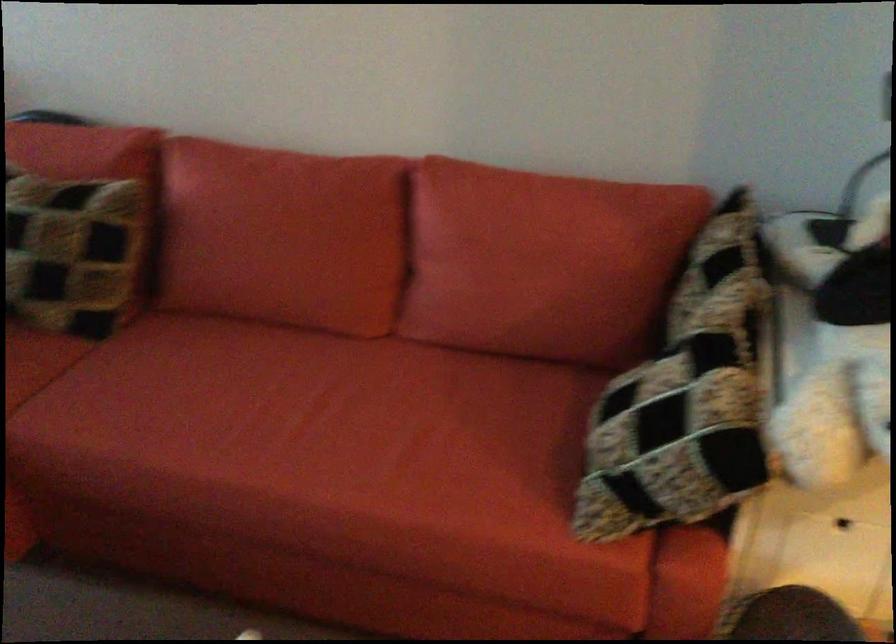
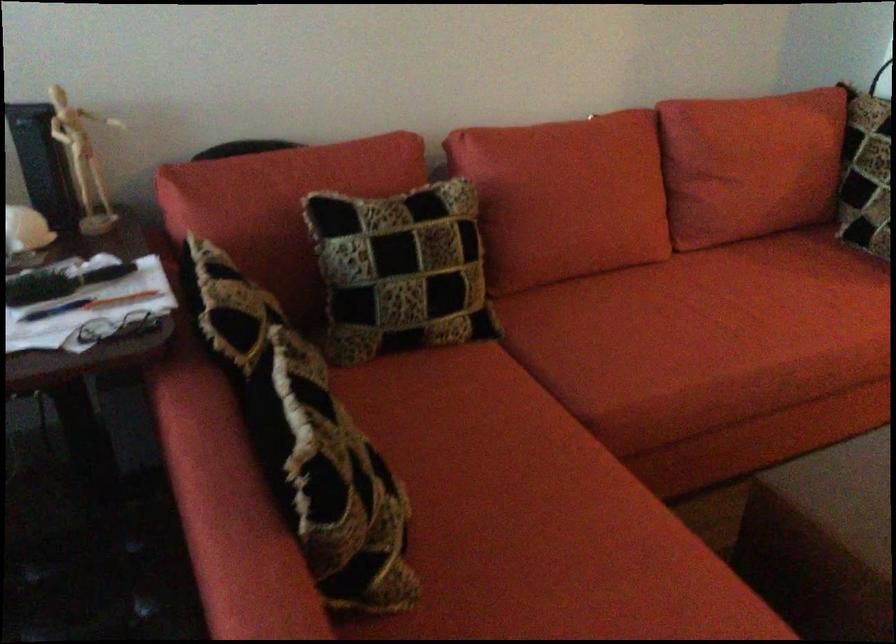
In the second image, find the point that corresponds to point 254,420 in the first image.

(726, 323)